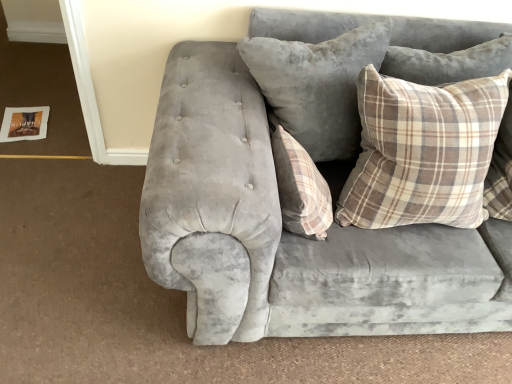
Question: Which is correct: velvet gray couch at center is inside plaid fabric pillow at upper right, positioned as the first pillow in right-to-left order, or outside of it?

Choices:
 (A) inside
 (B) outside

Answer: (B)

Question: Based on their sizes in the image, would you say velvet gray couch at center is bigger or smaller than plaid fabric pillow at upper right, positioned as the first pillow in right-to-left order?

Choices:
 (A) big
 (B) small

Answer: (A)

Question: Which object is the closest to the velvet gray pillow at center, positioned as the second pillow in right-to-left order?

Choices:
 (A) plaid fabric pillow at center, marked as the 3th pillow in a right-to-left arrangement
 (B) velvet gray couch at center
 (C) plaid fabric pillow at upper right, which is the third pillow in left-to-right order

Answer: (A)

Question: Which of these objects is positioned farthest from the plaid fabric pillow at upper right, positioned as the first pillow in right-to-left order?

Choices:
 (A) velvet gray pillow at center, which appears as the 2th pillow when viewed from the left
 (B) velvet gray couch at center
 (C) plaid fabric pillow at center, marked as the 3th pillow in a right-to-left arrangement

Answer: (C)